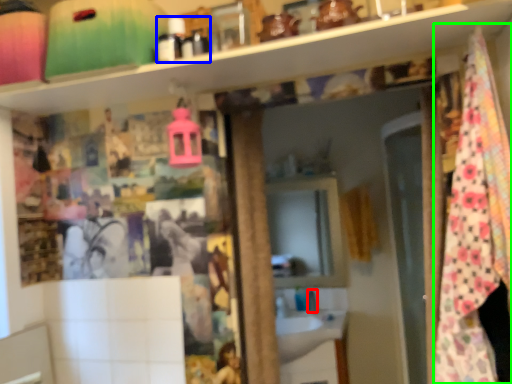
Question: Estimate the real-world distances between objects in this image. Which object is farther from faucet (highlighted by a red box), toiletry (highlighted by a blue box) or blanket (highlighted by a green box)?

Choices:
 (A) toiletry
 (B) blanket

Answer: (A)